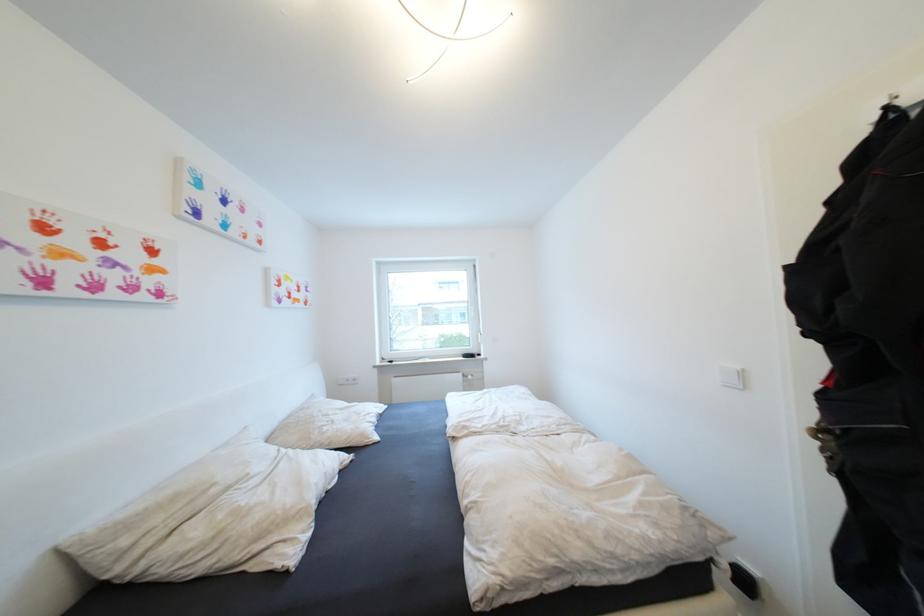
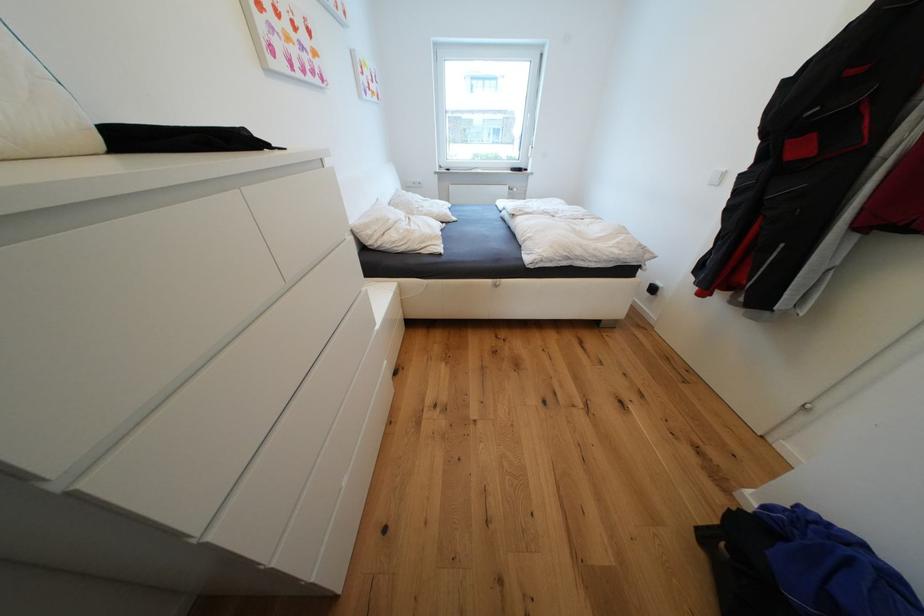
Where in the second image is the point corresponding to [471,429] from the first image?

(528, 212)